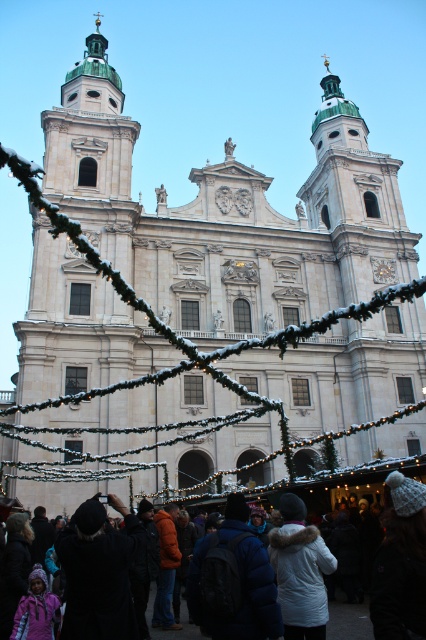
You are standing at the entrance of the historic church and see both the black woolen hat at center and the white woolen hat at lower center. Which hat is farther from the entrance?

The black woolen hat at center is farther from the entrance than the white woolen hat at lower center because it is 36.51 feet away from it.

You are standing in front of the historic church and see two hats, a black woolen hat at center and a white woolen hat at lower center. Which hat is located to the left of the other?

The black woolen hat at center is positioned on the left side of white woolen hat at lower center.